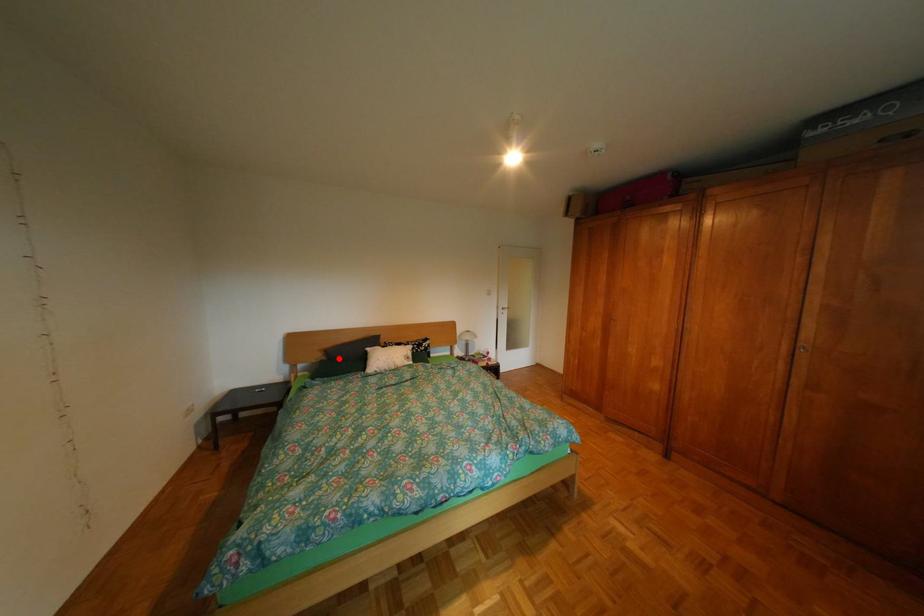
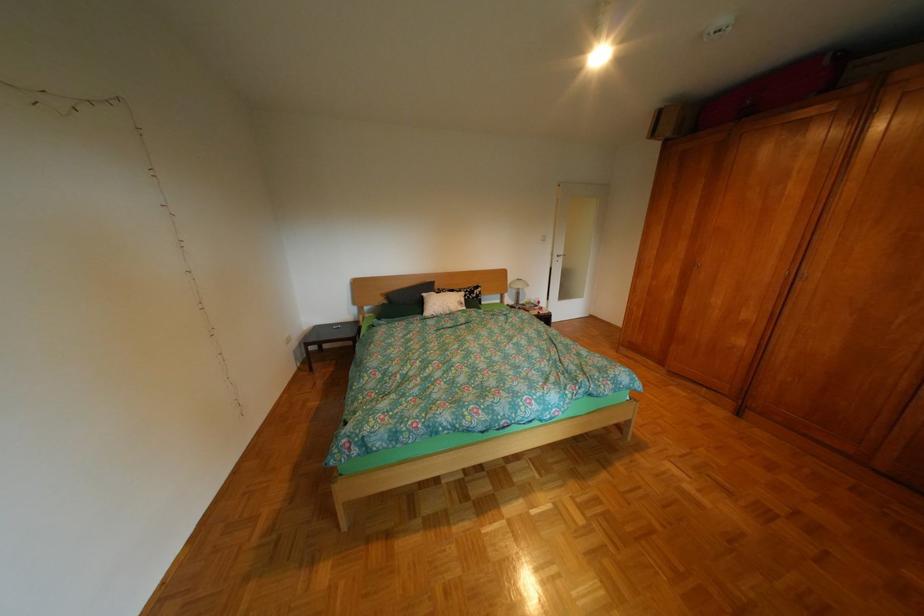
The point at the highlighted location is marked in the first image. Where is the corresponding point in the second image?

(400, 302)